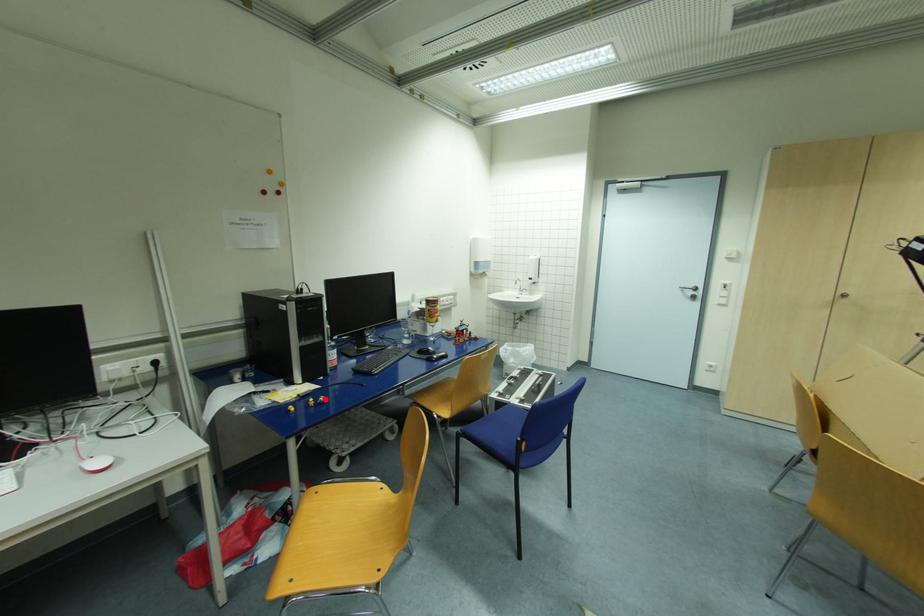
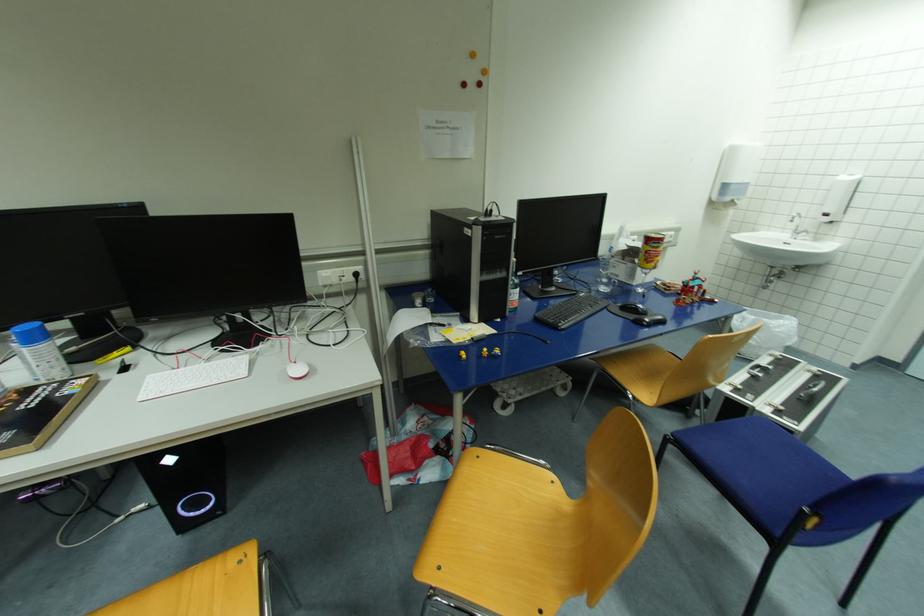
Question: I am providing you with two images of the same scene from different viewpoints. In image1, a red point is highlighted. Considering the same 3D point in image2, which of the following is correct?

Choices:
 (A) It is closer
 (B) It is farther

Answer: (B)